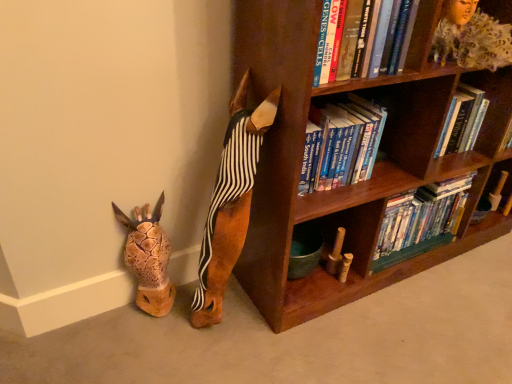
You are a GUI agent. You are given a task and a screenshot of the screen. Output one action in this format:
    pyautogui.click(x=<x>, y=<y>)
    Task: Click on the space that is in front of brown wooden bookcase at upper right
    The width and height of the screenshot is (512, 384).
    Given the screenshot: What is the action you would take?
    pyautogui.click(x=403, y=326)